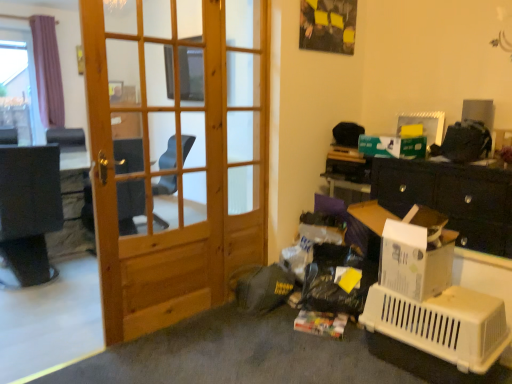
Question: Is point (474, 367) positioned closer to the camera than point (229, 29)?

Choices:
 (A) farther
 (B) closer

Answer: (B)

Question: From the image's perspective, is white plastic pet carrier at lower right positioned above or below wooden screen door at center?

Choices:
 (A) below
 (B) above

Answer: (A)

Question: Based on their relative distances, which object is farther from the natural wood door at center?

Choices:
 (A) wooden screen door at center
 (B) white plastic pet carrier at lower right

Answer: (B)

Question: Which object is positioned farthest from the natural wood door at center?

Choices:
 (A) white plastic pet carrier at lower right
 (B) wooden screen door at center

Answer: (A)